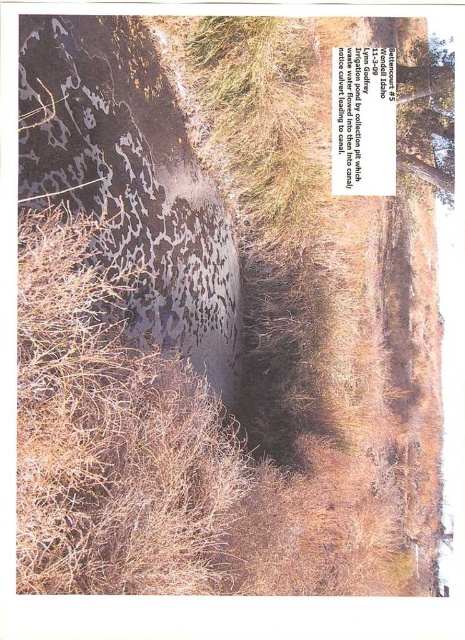
You are a landscape architect designing a new irrigation system. You need to place a new sensor that must be within sight of both the dark textured rock at left and the green leafy tree at upper right. Considering their sizes, which object might block the sensor from having a clear line of sight to the other?

The dark textured rock at left has a larger size compared to green leafy tree at upper right, so the dark textured rock at left might block the sensor from having a clear line of sight to the green leafy tree at upper right.

You are a landscape architect designing a new irrigation system. You notice the dark textured rock at left and the green leafy tree at upper right in the image. Which object is closer to you from your current viewpoint?

The dark textured rock at left is closer because it is in front of the green leafy tree at upper right.

You are a surveyor measuring distances between landmarks in a dry field. You need to determine if a 10 meter long fence can be placed between the dark textured rock at left and the green leafy tree at upper right. Can the fence fit between them?

The dark textured rock at left and the green leafy tree at upper right are 10.61 meters apart from each other. Since the fence is 10 meters long, it can fit between them with 0.61 meters of space remaining.